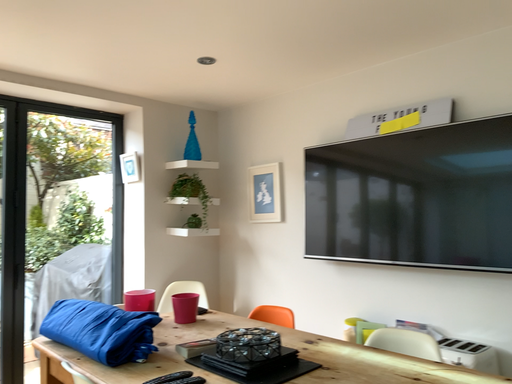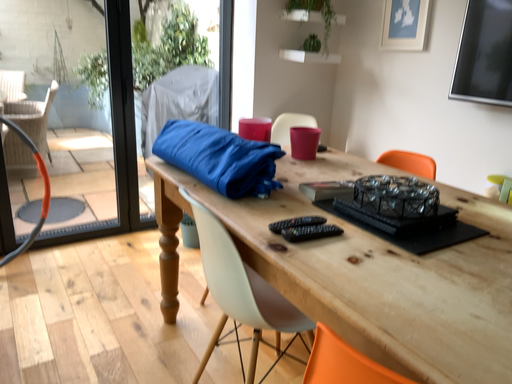
Question: How did the camera likely rotate when shooting the video?

Choices:
 (A) rotated right
 (B) rotated left

Answer: (B)